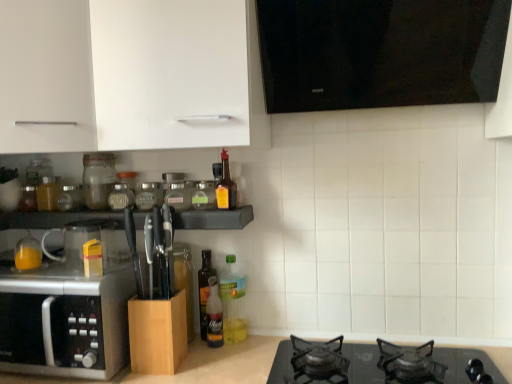
You are a GUI agent. You are given a task and a screenshot of the screen. Output one action in this format:
    pyautogui.click(x=<x>, y=<y>)
    Task: Click on the vacant space in front of transparent glass mug at left
    This screenshot has height=384, width=512.
    Given the screenshot: What is the action you would take?
    pyautogui.click(x=60, y=279)